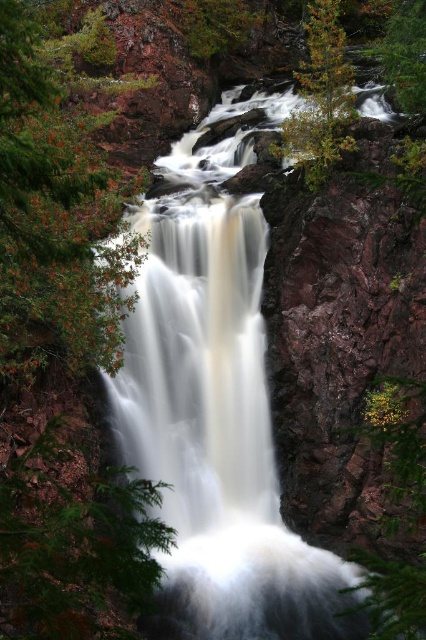
You are a hiker looking for a safe path to the waterfall. You notice the brown rough rock at center and the green matte tree at upper right. Which object is located higher up in the scene?

The green matte tree at upper right is located higher up in the scene because the brown rough rock at center is positioned under it.

You are a bird looking for a nesting spot. You see the green matte tree at left and the green matte tree at upper right. Which tree would provide a wider nesting area?

The green matte tree at left has a larger width than the green matte tree at upper right, so it would provide a wider nesting area.

You are standing at the base of the waterfall and want to take a photo of both the brown rough rock at center and the green matte tree at left. Which object should you position closer to the left side of your camera frame?

You should position the green matte tree at left closer to the left side of your camera frame because the brown rough rock at center is to the right of the green matte tree at left.